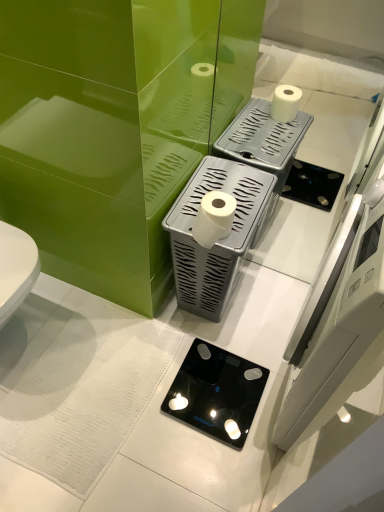
Locate an element on the screen. The height and width of the screenshot is (512, 384). vacant region below black glass scale at center, the second appliance when ordered from top to bottom (from a real-world perspective) is located at coordinates (215, 398).